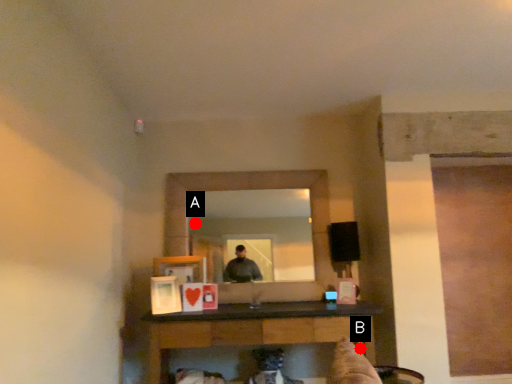
Question: Two points are circled on the image, labeled by A and B beside each circle. Which point is farther from the camera taking this photo?

Choices:
 (A) A is further
 (B) B is further

Answer: (A)